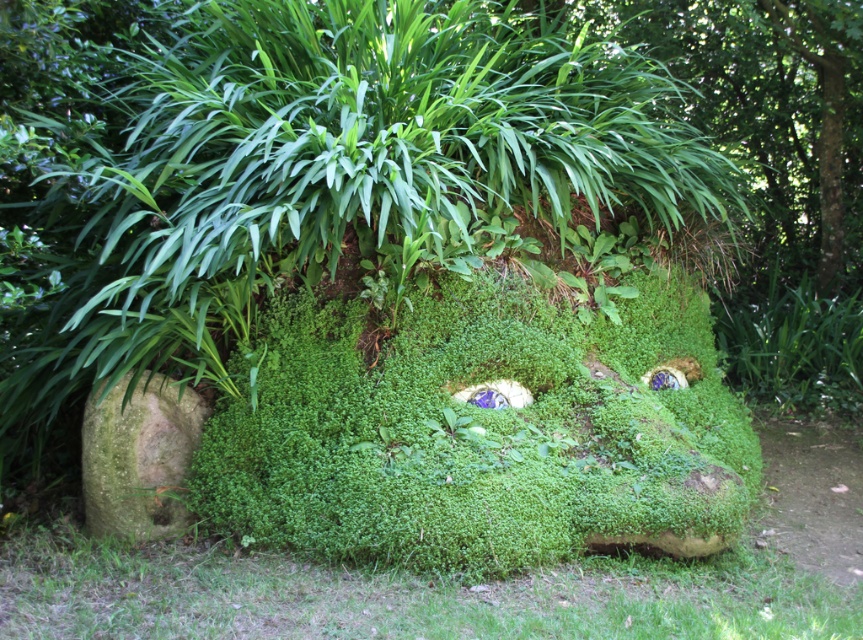
Image resolution: width=863 pixels, height=640 pixels. In order to click on green mossy rock at lower center in this screenshot , I will do `click(399, 595)`.

Can you confirm if green mossy rock at lower center is thinner than green mossy rock at lower left?

No.

Is point (142, 584) positioned in front of point (181, 460)?

Yes.

This screenshot has width=863, height=640. In order to click on green mossy rock at lower center in this screenshot , I will do `click(399, 595)`.